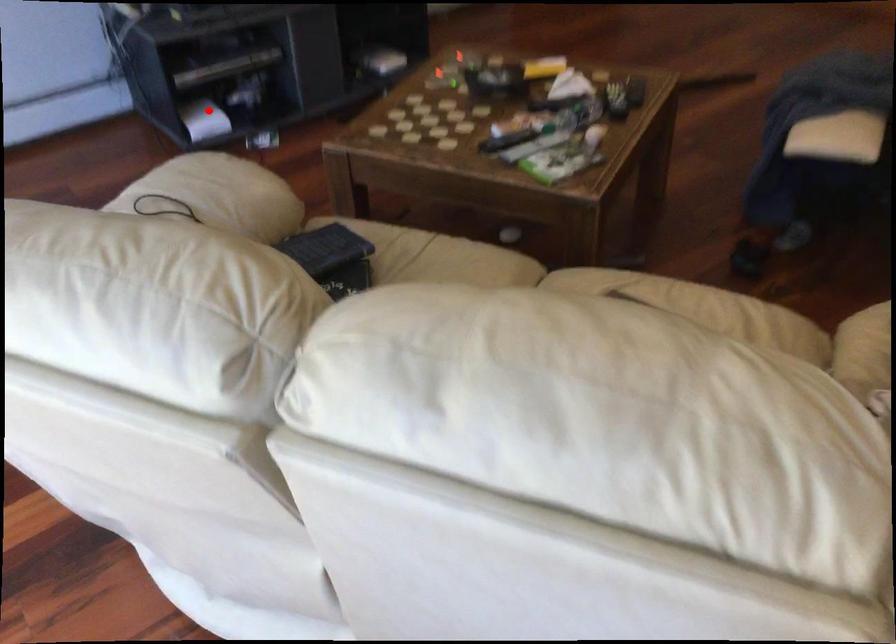
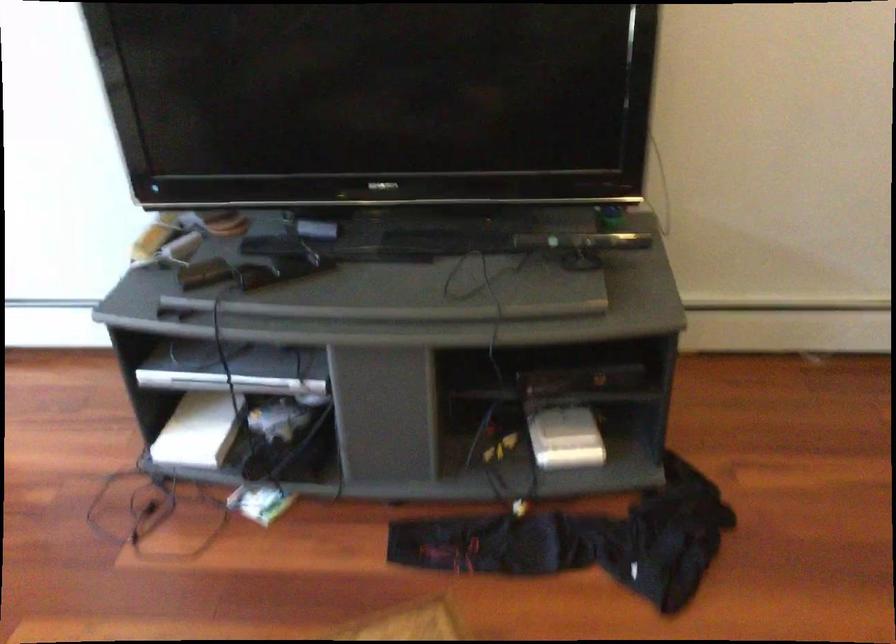
Find the pixel in the second image that matches the highlighted location in the first image.

(199, 430)